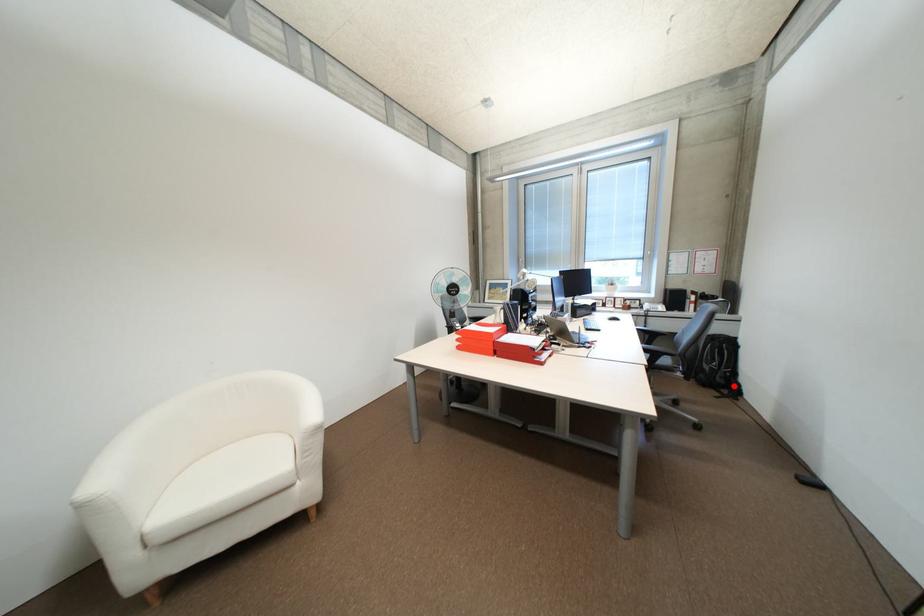
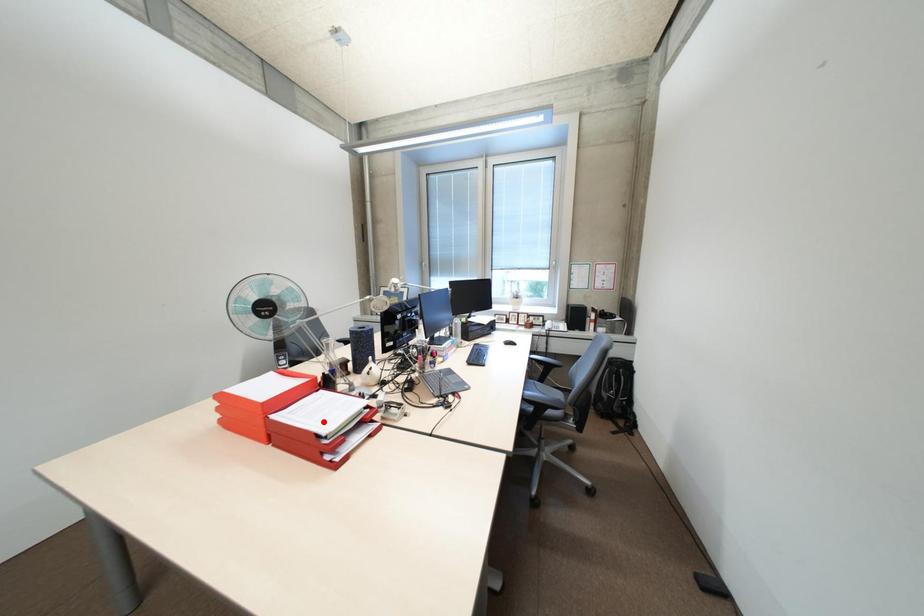
I am providing you with two images of the same scene from different viewpoints. A red point is marked on the first image and another point is marked on the second image. Is the marked point in image1 the same physical position as the marked point in image2?

No